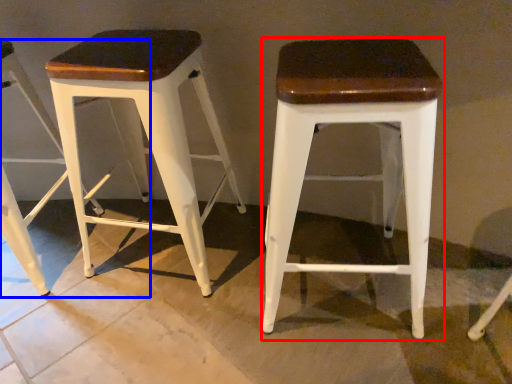
Question: Which object appears closest to the camera in this image, stool (highlighted by a red box) or stool (highlighted by a blue box)?

Choices:
 (A) stool
 (B) stool

Answer: (A)